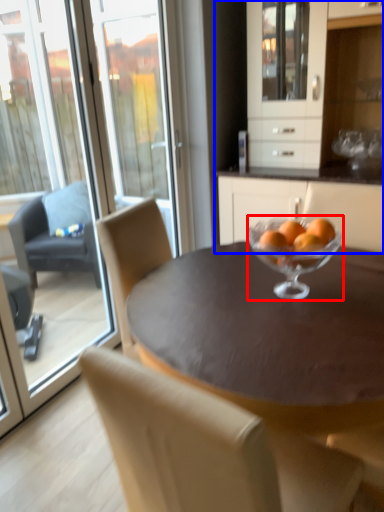
Question: Which point is closer to the camera, martini glass (highlighted by a red box) or cabinetry (highlighted by a blue box)?

Choices:
 (A) martini glass
 (B) cabinetry

Answer: (A)